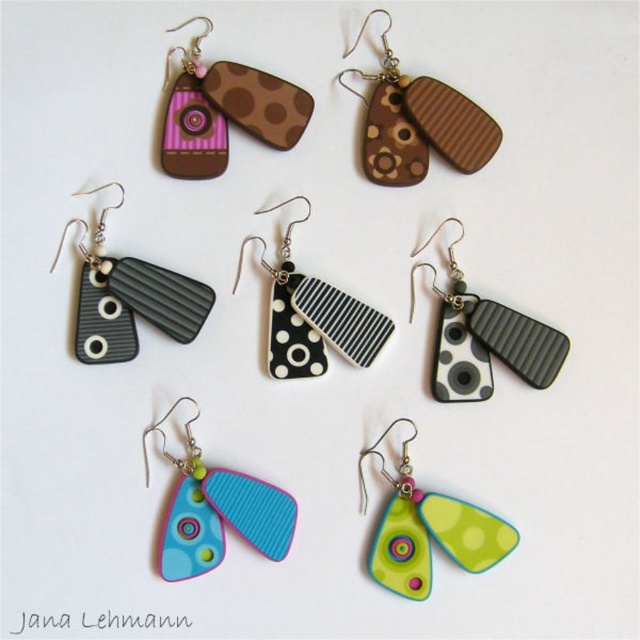
Question: Among these points, which one is nearest to the camera?

Choices:
 (A) (112, 209)
 (B) (477, 140)
 (C) (216, 497)

Answer: (A)

Question: Does green matte/soft plastic pendant at center have a smaller size compared to matte black rectangular at center?

Choices:
 (A) no
 (B) yes

Answer: (B)

Question: Can you confirm if matte black rectangular at left is positioned to the left of green matte/soft plastic pendant at center?

Choices:
 (A) no
 (B) yes

Answer: (B)

Question: Is brown textured rectangle at upper center bigger than matte black rectangular at left?

Choices:
 (A) no
 (B) yes

Answer: (A)

Question: Which point is closer to the camera?

Choices:
 (A) matte black rectangular at center
 (B) black and white striped rectangular earrings at center
 (C) matte plastic earrings at center

Answer: (C)

Question: Which point is farther from the camera taking this photo?

Choices:
 (A) (461, 365)
 (B) (202, 465)
 (C) (122, 301)
 (D) (280, 330)

Answer: (D)